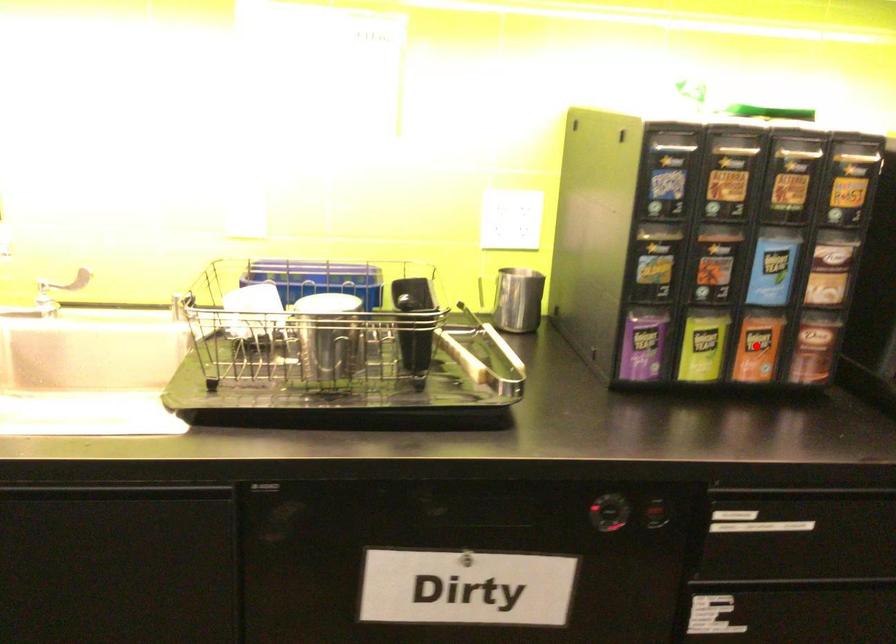
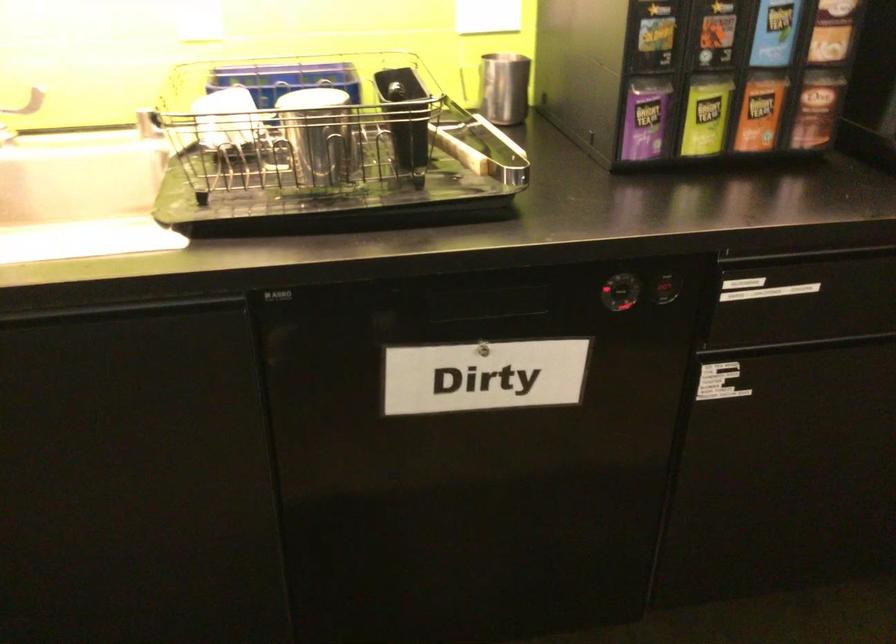
The point at the highlighted location is marked in the first image. Where is the corresponding point in the second image?

(760, 111)